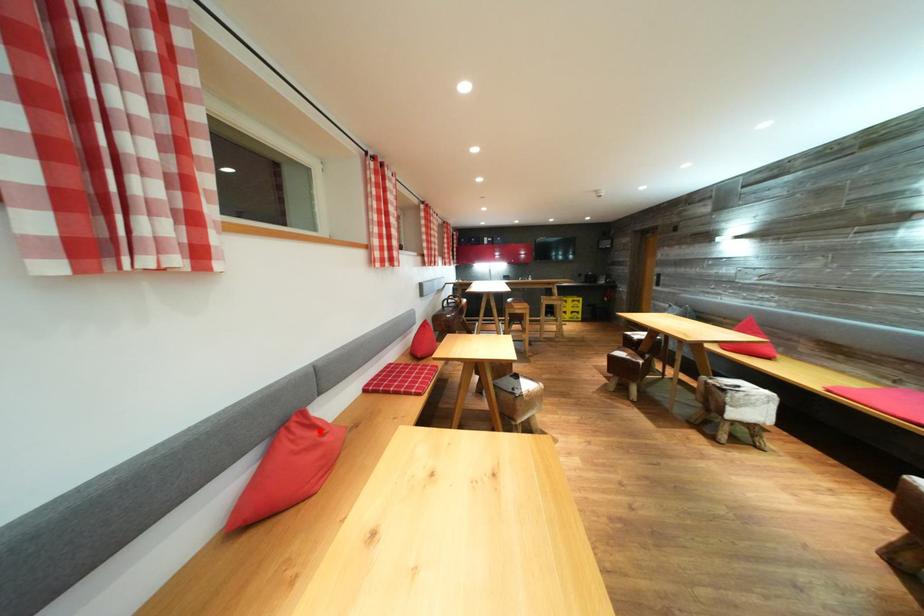
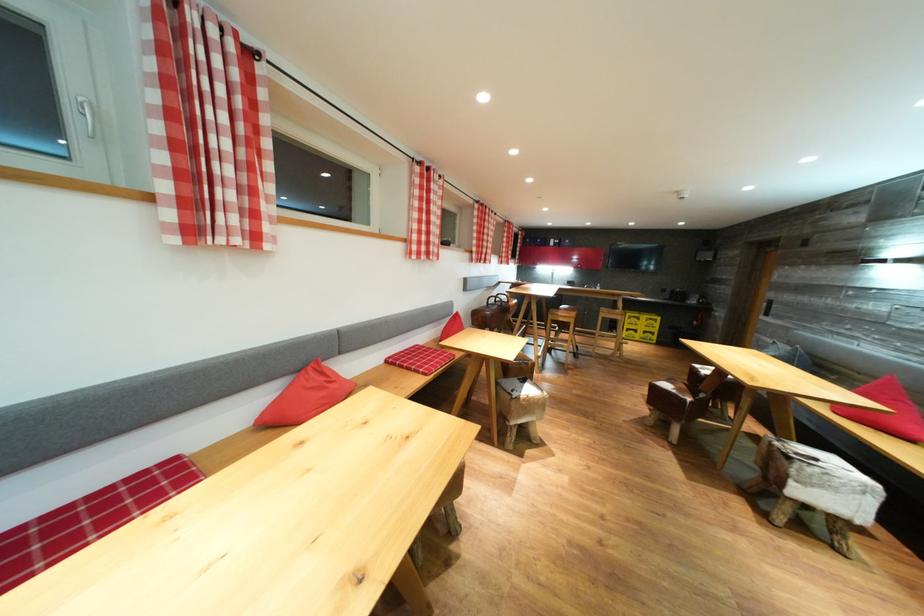
Locate, in the second image, the point that corresponds to the highlighted location in the first image.

(330, 378)